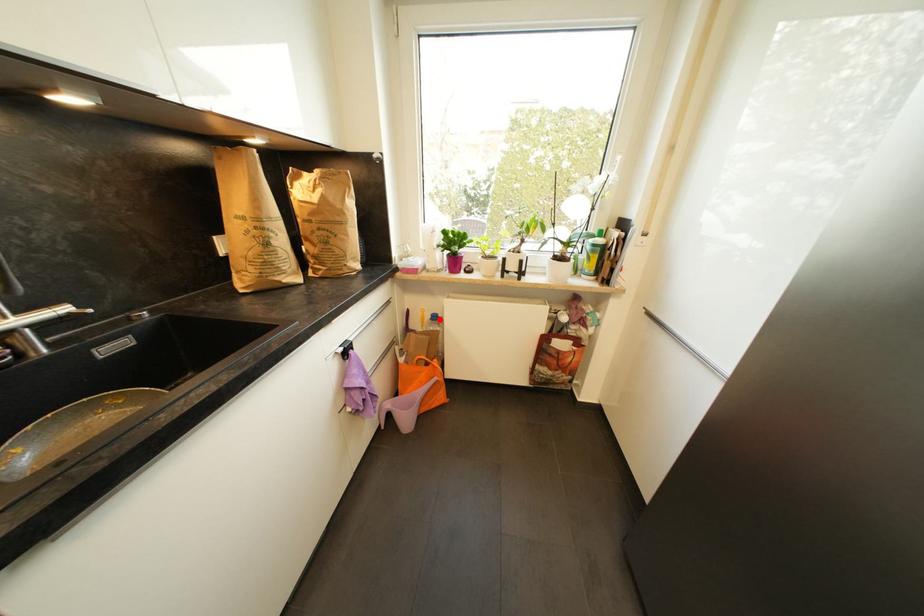
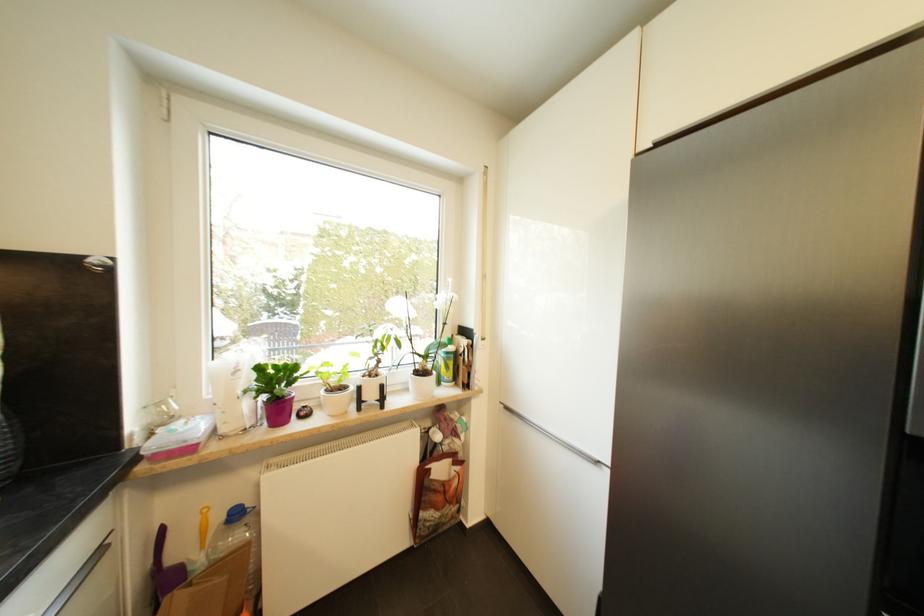
The point at the highlighted location is marked in the first image. Where is the corresponding point in the second image?

(241, 517)